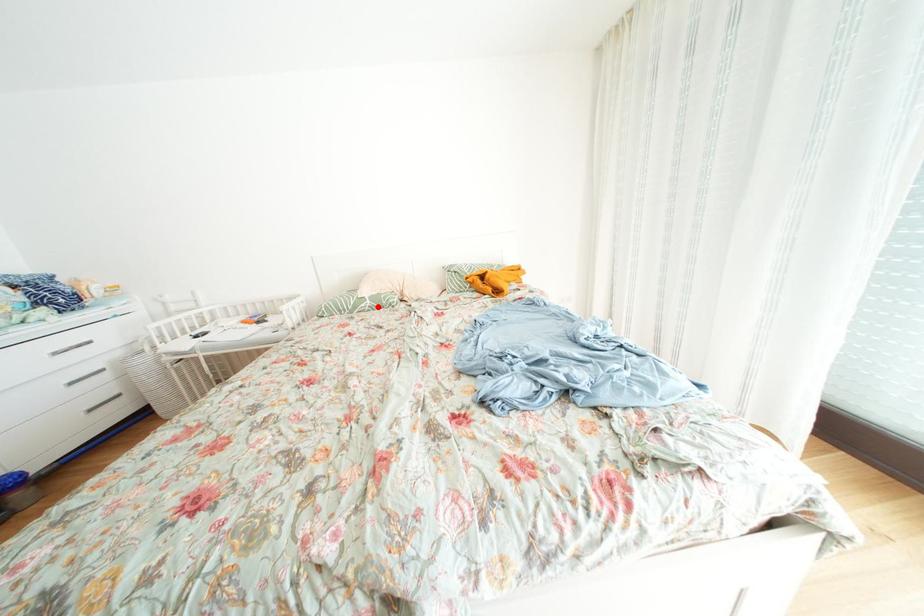
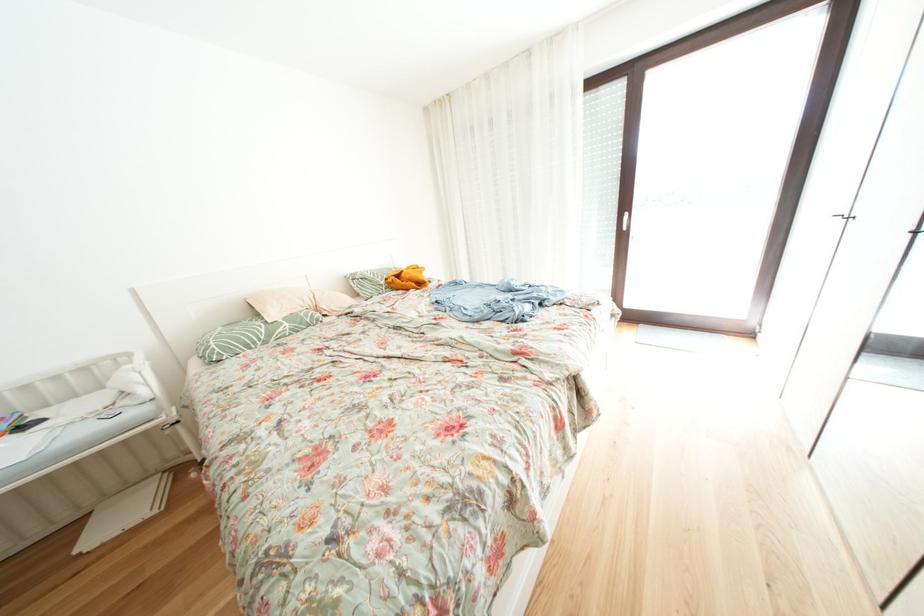
Locate, in the second image, the point that corresponds to the highlighted location in the first image.

(296, 329)